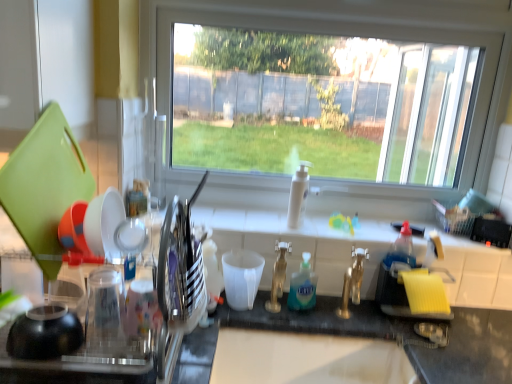
Question: Considering the relative sizes of clear plastic dish rack at left and shiny silver utensil holder at left, the second tableware when ordered from right to left, in the image provided, is clear plastic dish rack at left thinner than shiny silver utensil holder at left, the second tableware when ordered from right to left,?

Choices:
 (A) no
 (B) yes

Answer: (A)

Question: Does clear plastic dish rack at left come behind shiny silver utensil holder at left, the second tableware viewed from the left?

Choices:
 (A) yes
 (B) no

Answer: (B)

Question: Is clear plastic dish rack at left to the right of shiny silver utensil holder at left, the second tableware when ordered from right to left, from the viewer's perspective?

Choices:
 (A) yes
 (B) no

Answer: (B)

Question: Considering the relative sizes of clear plastic dish rack at left and shiny silver utensil holder at left, the second tableware when ordered from right to left, in the image provided, is clear plastic dish rack at left taller than shiny silver utensil holder at left, the second tableware when ordered from right to left,?

Choices:
 (A) no
 (B) yes

Answer: (B)

Question: Is shiny silver utensil holder at left, the second tableware when ordered from right to left, completely or partially inside clear plastic dish rack at left?

Choices:
 (A) yes
 (B) no

Answer: (B)

Question: Is point (293, 306) closer or farther from the camera than point (122, 215)?

Choices:
 (A) farther
 (B) closer

Answer: (A)

Question: Looking at their shapes, would you say blue translucent liquid soap at center is wider or thinner than white glossy bowl at left, the 1th tableware positioned from the left?

Choices:
 (A) wide
 (B) thin

Answer: (B)

Question: From a real-world perspective, is blue translucent liquid soap at center physically located above or below white glossy bowl at left, the 1th tableware positioned from the left?

Choices:
 (A) above
 (B) below

Answer: (B)

Question: Based on their sizes in the image, would you say blue translucent liquid soap at center is bigger or smaller than white glossy bowl at left, arranged as the 3th tableware when viewed from the right?

Choices:
 (A) small
 (B) big

Answer: (A)

Question: Is white glossy bowl at left, the 1th tableware positioned from the left, spatially inside shiny silver utensil holder at left, the second tableware when ordered from right to left, or outside of it?

Choices:
 (A) inside
 (B) outside

Answer: (B)

Question: From the image's perspective, is white glossy bowl at left, arranged as the 3th tableware when viewed from the right, located above or below shiny silver utensil holder at left, the second tableware when ordered from right to left?

Choices:
 (A) below
 (B) above

Answer: (B)

Question: In the image, is white glossy bowl at left, the 1th tableware positioned from the left, positioned in front of or behind shiny silver utensil holder at left, the second tableware when ordered from right to left?

Choices:
 (A) behind
 (B) front

Answer: (A)

Question: Is white glossy bowl at left, the 1th tableware positioned from the left, taller or shorter than shiny silver utensil holder at left, the second tableware viewed from the left?

Choices:
 (A) short
 (B) tall

Answer: (A)

Question: From the image's perspective, is white matte measuring cup at center, the 1th tableware in the right-to-left sequence, positioned above or below transparent glass window at center?

Choices:
 (A) above
 (B) below

Answer: (B)

Question: From a real-world perspective, is white matte measuring cup at center, the 1th tableware in the right-to-left sequence, positioned above or below transparent glass window at center?

Choices:
 (A) above
 (B) below

Answer: (B)